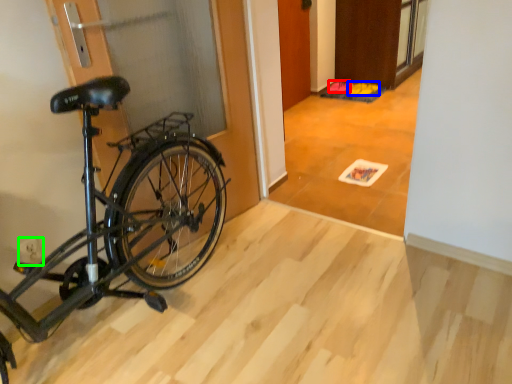
Question: Estimate the real-world distances between objects in this image. Which object is closer to walking shoe (highlighted by a red box), walking shoe (highlighted by a blue box) or power plugs and sockets (highlighted by a green box)?

Choices:
 (A) walking shoe
 (B) power plugs and sockets

Answer: (A)